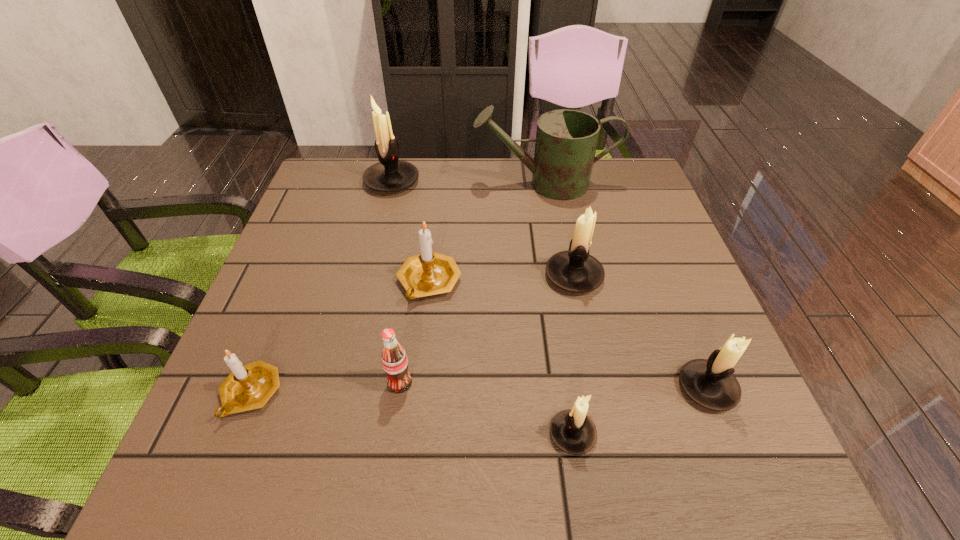
Where is `blank space at the far edge of the desktop`? blank space at the far edge of the desktop is located at coordinates (398, 199).

The image size is (960, 540). What are the coordinates of `vacant position at the near edge of the desktop` in the screenshot? It's located at pyautogui.click(x=658, y=449).

This screenshot has width=960, height=540. In order to click on free region at the left edge of the desktop in this screenshot , I will do coord(313,239).

I want to click on free spot at the right edge of the desktop, so click(x=608, y=225).

This screenshot has width=960, height=540. In the image, there is a desktop. In order to click on vacant space at the far left corner in this screenshot , I will do `click(346, 190)`.

I want to click on free region at the near left corner of the desktop, so click(200, 438).

Locate an element on the screen. The image size is (960, 540). free location at the far right corner is located at coordinates (601, 167).

This screenshot has width=960, height=540. What are the coordinates of `free space at the near right corner of the desktop` in the screenshot? It's located at (752, 434).

Locate an element on the screen. This screenshot has height=540, width=960. empty space that is in between the nearer gold candle holder and the biggest white candle holder is located at coordinates (322, 287).

You are a GUI agent. You are given a task and a screenshot of the screen. Output one action in this format:
    pyautogui.click(x=<x>, y=<y>)
    Task: Click on the empty location between the green watering can and the smallest white candle holder
    
    Given the screenshot: What is the action you would take?
    pyautogui.click(x=559, y=309)